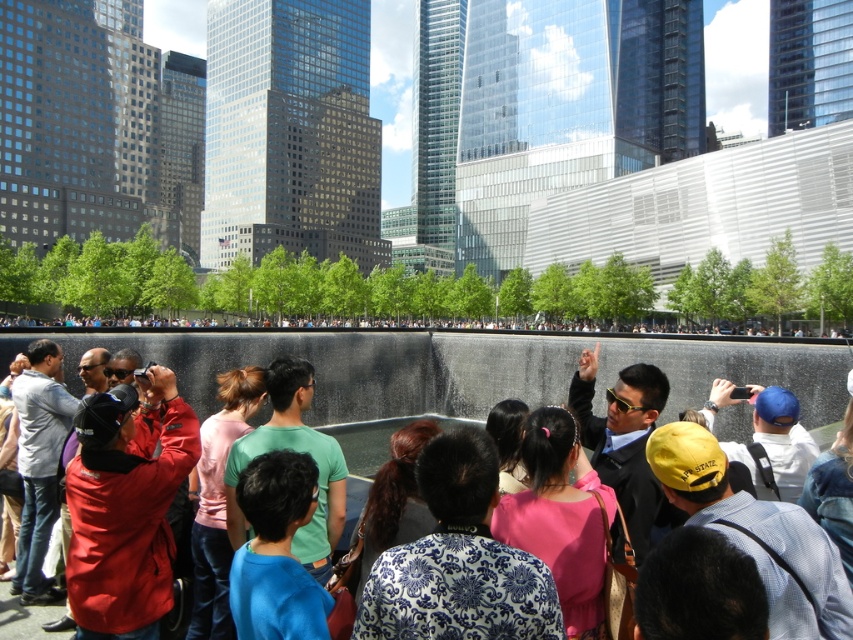
You are a photographer trying to capture the pink fabric dress at center and the dark blue fabric at lower center in a single shot. Which object is closer to the camera, and which is farther away?

The dark blue fabric at lower center is behind the pink fabric dress at center, so the pink fabric dress at center is closer to the camera, and the dark blue fabric at lower center is farther away.

You are a photographer trying to capture a candid shot of the pink fabric shirt at center and the black hair at center in the urban scene. Based on their positions, which one is positioned higher in the frame?

The pink fabric shirt at center is positioned higher in the frame than the black hair at center.

You are standing at the center of the scene and want to take a photo of the pink fabric shirt at center. Where should you aim your camera to capture the shirt in the frame?

You should aim your camera at the point with coordinates 0.783 on the x axis and 0.257 on the y axis to capture the pink fabric shirt at center.